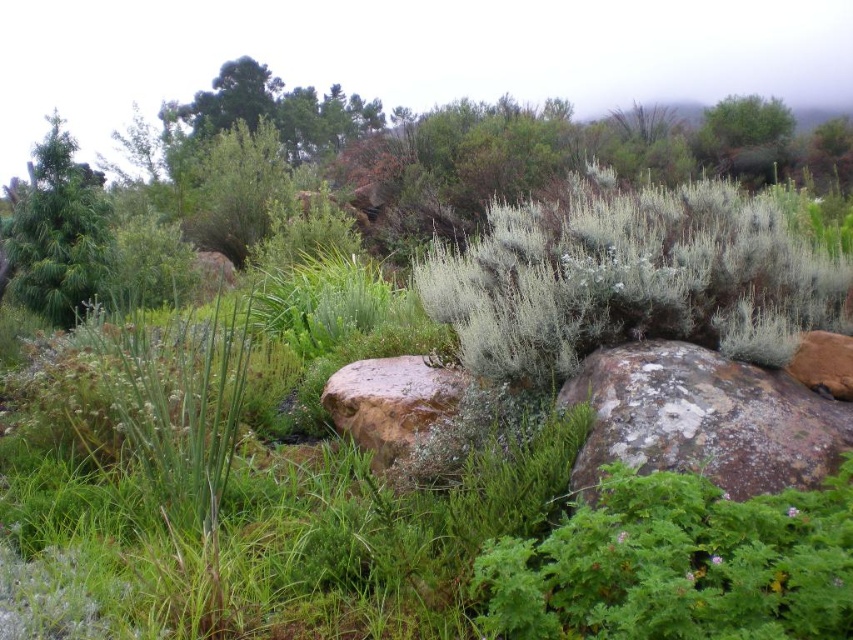
Question: Which object is the farthest from the brown rough boulder at center?

Choices:
 (A) speckled brown rock at center-right
 (B) green matte pine tree at left

Answer: (B)

Question: Among these objects, which one is nearest to the camera?

Choices:
 (A) speckled brown rock at center-right
 (B) brown rough boulder at center

Answer: (A)

Question: Is speckled brown rock at center-right positioned behind brown rough boulder at center?

Choices:
 (A) no
 (B) yes

Answer: (A)

Question: Is speckled brown rock at center-right below green matte pine tree at left?

Choices:
 (A) yes
 (B) no

Answer: (A)

Question: Considering the real-world distances, which object is farthest from the green matte pine tree at left?

Choices:
 (A) speckled brown rock at center-right
 (B) brown rough boulder at center

Answer: (A)

Question: Can you confirm if speckled brown rock at center-right is positioned to the left of green matte pine tree at left?

Choices:
 (A) no
 (B) yes

Answer: (A)